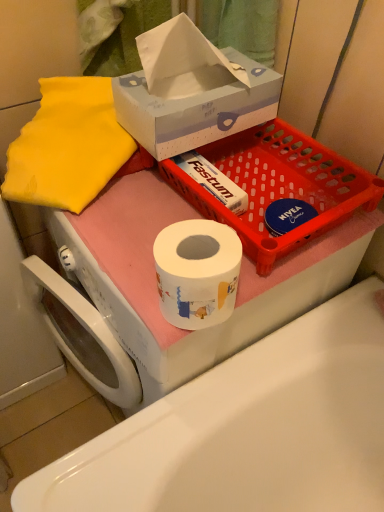
Question: Is white cardboard tissue box at upper center in front of or behind white glossy toilet paper at center in the image?

Choices:
 (A) front
 (B) behind

Answer: (B)

Question: Considering the positions of white cardboard tissue box at upper center and white glossy toilet paper at center in the image, is white cardboard tissue box at upper center wider or thinner than white glossy toilet paper at center?

Choices:
 (A) thin
 (B) wide

Answer: (A)

Question: Which of these objects is positioned farthest from the matte plastic basket at upper center?

Choices:
 (A) white cardboard tissue box at upper center
 (B) white glossy toilet paper at center

Answer: (B)

Question: Estimate the real-world distances between objects in this image. Which object is farther from the white cardboard tissue box at upper center?

Choices:
 (A) white glossy toilet paper at center
 (B) matte plastic basket at upper center

Answer: (A)